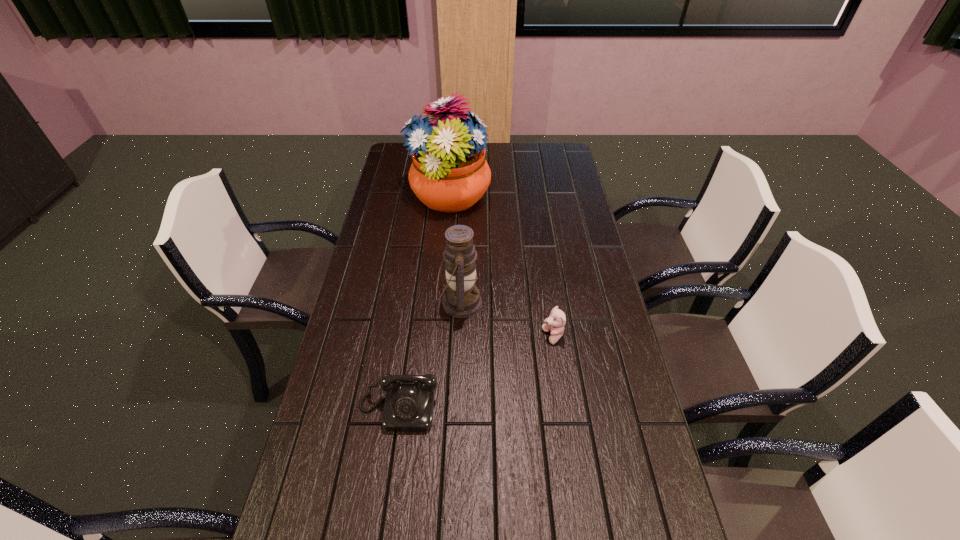
Where is `flower arrangement`? flower arrangement is located at coordinates (449, 173).

The width and height of the screenshot is (960, 540). I want to click on the farthest object, so click(449, 173).

Where is `the second tallest object`? the second tallest object is located at coordinates (461, 299).

This screenshot has height=540, width=960. I want to click on oil lamp, so click(x=461, y=299).

Identify the location of the rightmost object. Image resolution: width=960 pixels, height=540 pixels. (555, 323).

Locate an element on the screen. The image size is (960, 540). teddy bear is located at coordinates (555, 323).

Locate an element on the screen. The height and width of the screenshot is (540, 960). telephone is located at coordinates (409, 402).

You are a GUI agent. You are given a task and a screenshot of the screen. Output one action in this format:
    pyautogui.click(x=<x>, y=<y>)
    Task: Click on the vacant region located 0.370m on the front of the flower arrangement
    
    Given the screenshot: What is the action you would take?
    pyautogui.click(x=441, y=299)

I want to click on blank space located 0.400m on the back of the third shortest object, so [x=464, y=210].

Locate an element on the screen. The height and width of the screenshot is (540, 960). vacant space located at the face of the teddy bear is located at coordinates point(512,336).